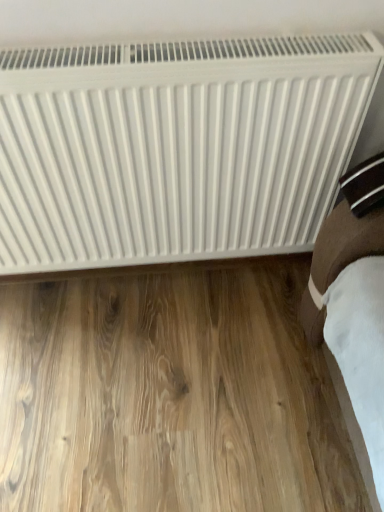
In order to click on free space above white matte radiator at upper center (from a real-world perspective) in this screenshot , I will do `click(144, 41)`.